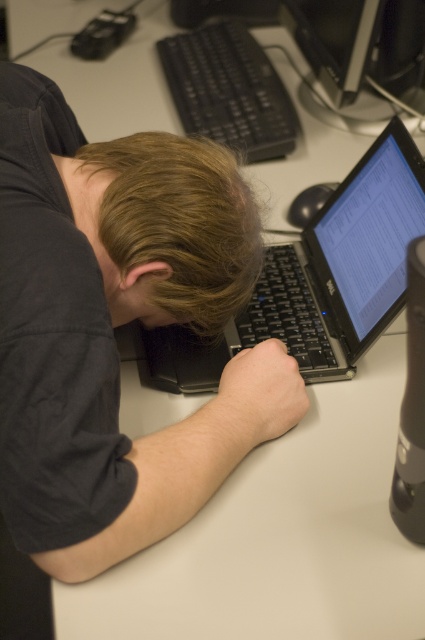
Question: Is brown matte hair at center further to the viewer compared to black glossy monitor at upper center?

Choices:
 (A) yes
 (B) no

Answer: (B)

Question: Estimate the real-world distances between objects in this image. Which object is farther from the brown matte hair at center?

Choices:
 (A) smooth skin hand at center
 (B) black plastic keyboard at upper center
 (C) dark gray shirt at center

Answer: (B)

Question: Is brown matte hair at center below black plastic keyboard at upper center?

Choices:
 (A) no
 (B) yes

Answer: (B)

Question: Does dark gray shirt at center have a greater width compared to smooth skin hand at center?

Choices:
 (A) no
 (B) yes

Answer: (B)

Question: Which object is farther from the camera taking this photo?

Choices:
 (A) smooth skin hand at center
 (B) black matte laptop at center
 (C) black plastic keyboard at upper center

Answer: (C)

Question: Among these points, which one is farthest from the camera?

Choices:
 (A) (388, 144)
 (B) (235, 365)
 (C) (212, 129)
 (D) (255, 241)

Answer: (C)